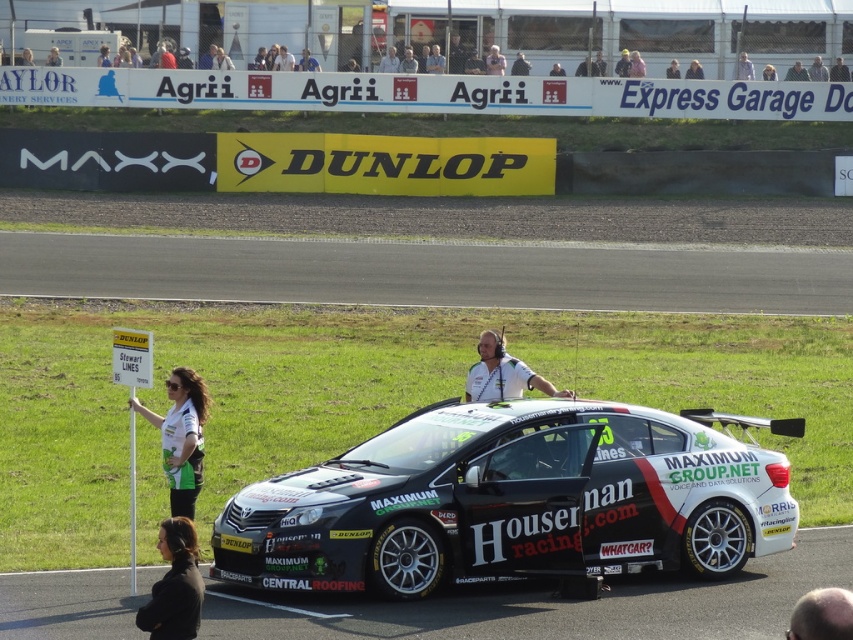
You are a photographer at the motorsport event and want to capture a clear photo of the light brown hair at center without the light brown leather jacket at upper center blocking it. What should you do?

Move the camera downward so that the light brown hair at center is visible below the light brown leather jacket at upper center, since the jacket is positioned over the hair.

You are a photographer at the motorsport event and want to capture a photo of the two people near the racing car. The light brown leather jacket at upper center and the light brown hair at center are in your viewfinder. Which object should you focus on first to ensure it appears larger in the photo?

The light brown leather jacket at upper center is taller than the light brown hair at center, so focusing on the light brown leather jacket at upper center will make it appear larger in the photo.